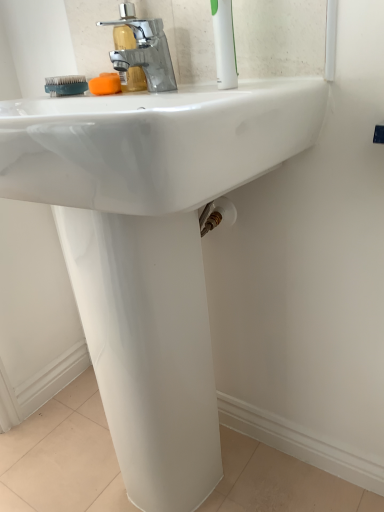
Question: Is orange sponge at upper center facing towards polished chrome faucet at upper center?

Choices:
 (A) yes
 (B) no

Answer: (B)

Question: Is polished chrome faucet at upper center completely or partially inside orange sponge at upper center?

Choices:
 (A) no
 (B) yes

Answer: (A)

Question: Can you confirm if orange sponge at upper center is wider than polished chrome faucet at upper center?

Choices:
 (A) yes
 (B) no

Answer: (A)

Question: Is orange sponge at upper center directly adjacent to polished chrome faucet at upper center?

Choices:
 (A) no
 (B) yes

Answer: (B)

Question: Is polished chrome faucet at upper center at the back of orange sponge at upper center?

Choices:
 (A) no
 (B) yes

Answer: (A)

Question: In the image, is orange sponge at upper center positioned in front of or behind teal rubber brush at upper left?

Choices:
 (A) behind
 (B) front

Answer: (B)

Question: From a real-world perspective, is orange sponge at upper center physically located above or below teal rubber brush at upper left?

Choices:
 (A) below
 (B) above

Answer: (A)

Question: Does point (96, 82) appear closer or farther from the camera than point (79, 92)?

Choices:
 (A) farther
 (B) closer

Answer: (B)

Question: From the image's perspective, is orange sponge at upper center positioned above or below teal rubber brush at upper left?

Choices:
 (A) above
 (B) below

Answer: (B)

Question: Is white plastic toothbrush at upper right taller or shorter than polished chrome faucet at upper center?

Choices:
 (A) short
 (B) tall

Answer: (B)

Question: From the image's perspective, relative to polished chrome faucet at upper center, is white plastic toothbrush at upper right above or below?

Choices:
 (A) below
 (B) above

Answer: (A)

Question: From a real-world perspective, is white plastic toothbrush at upper right physically located above or below polished chrome faucet at upper center?

Choices:
 (A) below
 (B) above

Answer: (B)

Question: Is white plastic toothbrush at upper right bigger or smaller than polished chrome faucet at upper center?

Choices:
 (A) small
 (B) big

Answer: (A)

Question: Is teal rubber brush at upper left wider or thinner than orange sponge at upper center?

Choices:
 (A) thin
 (B) wide

Answer: (A)

Question: Is teal rubber brush at upper left spatially inside orange sponge at upper center, or outside of it?

Choices:
 (A) inside
 (B) outside

Answer: (B)